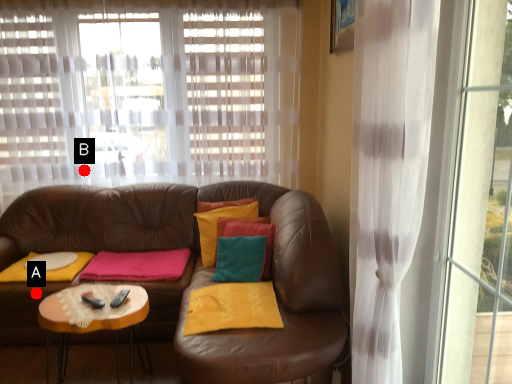
Question: Two points are circled on the image, labeled by A and B beside each circle. Among these points, which one is nearest to the camera?

Choices:
 (A) A is closer
 (B) B is closer

Answer: (A)